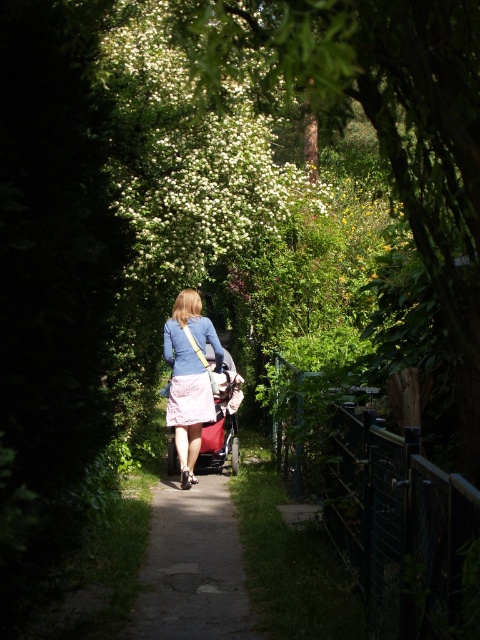
Who is higher up, pink fabric skirt at center or pink satin dress at center?

pink satin dress at center is higher up.

Can you confirm if pink fabric skirt at center is shorter than pink satin dress at center?

In fact, pink fabric skirt at center may be taller than pink satin dress at center.

Which is behind, point (192, 333) or point (197, 396)?

The point (197, 396) is more distant.

Find the location of a particular element. pink fabric skirt at center is located at coordinates (190, 378).

Does point (252, 625) lie behind point (179, 422)?

No, it is not.

Is point (177, 580) positioned before point (194, 408)?

That is True.

The width and height of the screenshot is (480, 640). I want to click on paved asphalt path at center, so click(192, 566).

Is point (181, 452) positioned after point (239, 449)?

No, it is in front of (239, 449).

From the picture: Between pink fabric skirt at center and red fabric stroller at center, which one appears on the left side from the viewer's perspective?

pink fabric skirt at center is more to the left.

Is point (170, 416) farther from camera compared to point (237, 465)?

No, it is not.

Identify the location of pink fabric skirt at center. (190, 378).